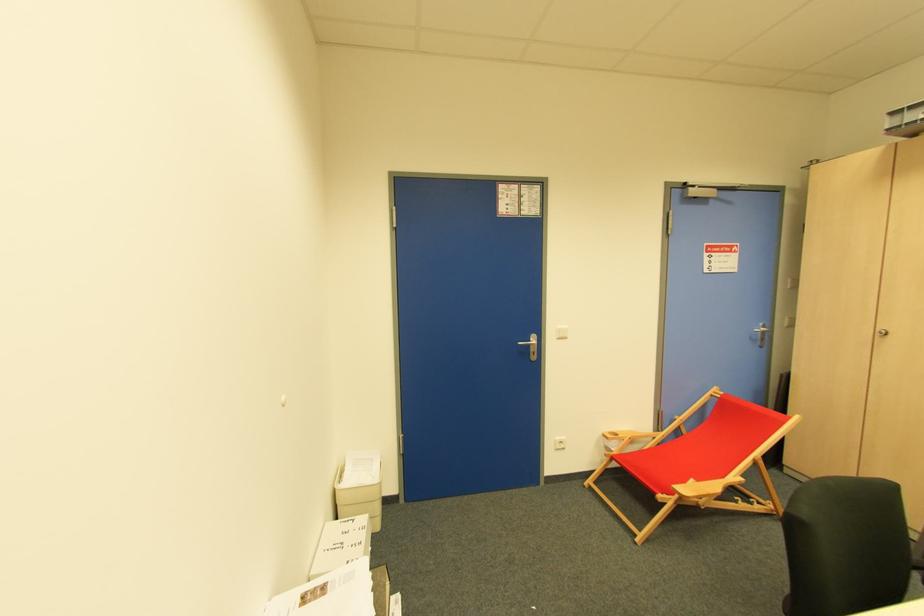
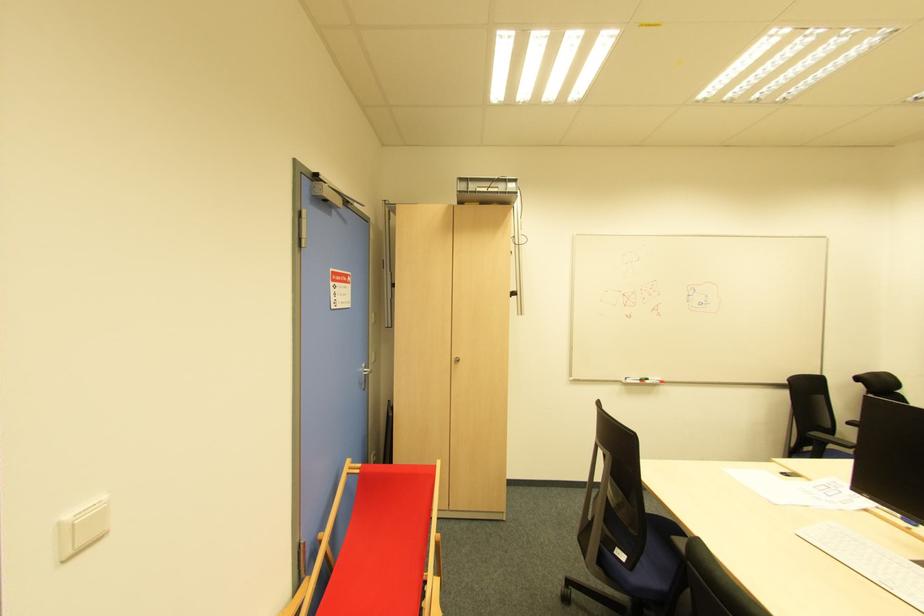
In the second image, find the point that corresponds to the point at 716,400 in the first image.

(357, 477)